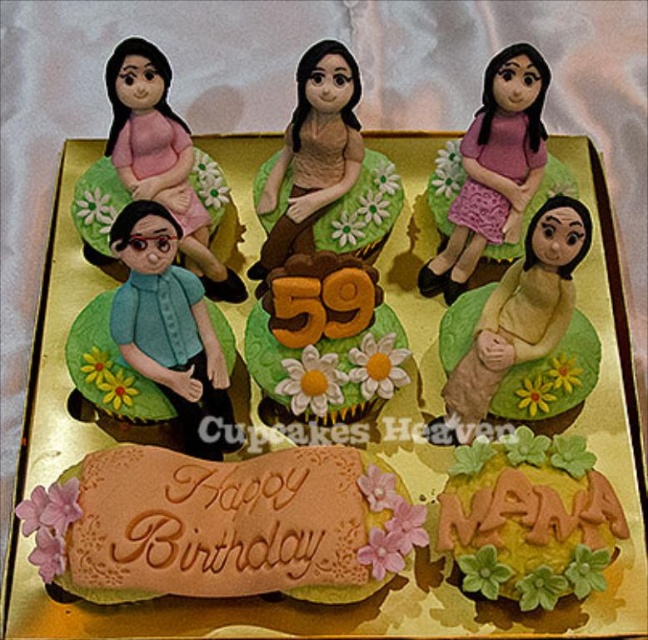
Looking at the birthday cake for NANA, there are two dolls on it. One is a matte pink fabric doll at upper left and the other is a matte brown doll at center. Which doll is positioned lower on the cake?

The matte pink fabric doll at upper left is positioned below the matte brown doll at center, so it is lower on the cake.

Looking at the cake, which of the two dolls, the matte pink fabric doll at upper left or the pink fabric doll at upper center, is positioned to the right?

The pink fabric doll at upper center is positioned to the right of the matte pink fabric doll at upper left.